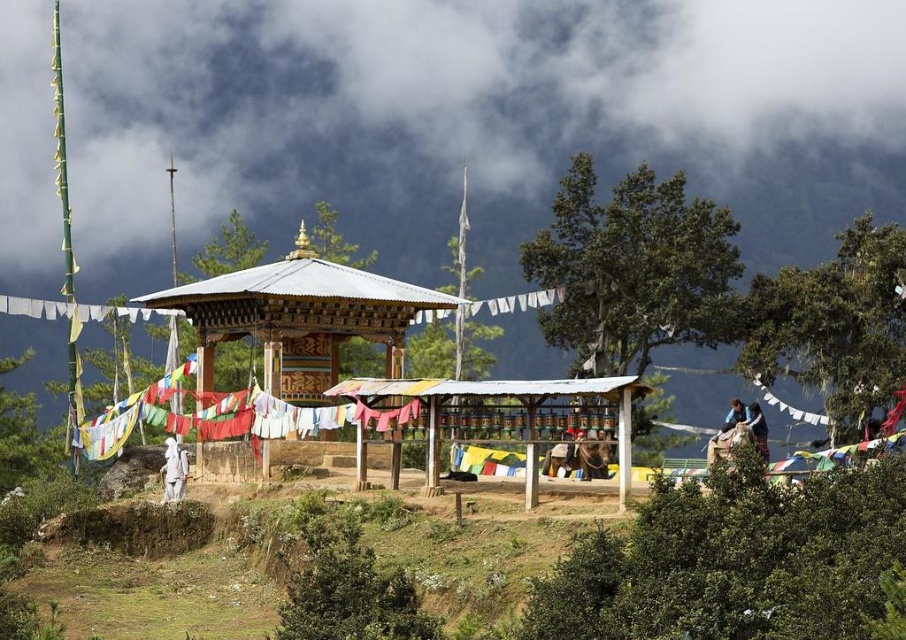
Question: Considering the real-world distances, which object is closest to the green leafy tree at upper right?

Choices:
 (A) white cloth at center
 (B) light brown leather jacket at upper right
 (C) dark gray cloud at upper center

Answer: (B)

Question: Which point is closer to the camera?

Choices:
 (A) (654, 544)
 (B) (803, 380)
 (C) (728, 420)

Answer: (A)

Question: Can you confirm if green leafy bush at lower right is positioned above white cloth at center?

Choices:
 (A) yes
 (B) no

Answer: (A)

Question: Observing the image, what is the correct spatial positioning of dark gray cloud at upper center in reference to dark blue fabric at right?

Choices:
 (A) above
 (B) below

Answer: (A)

Question: Does green leafy tree at upper center appear under dark blue fabric at right?

Choices:
 (A) yes
 (B) no

Answer: (B)

Question: Which point is closer to the camera?

Choices:
 (A) white cloth at center
 (B) light brown leather jacket at upper right

Answer: (A)